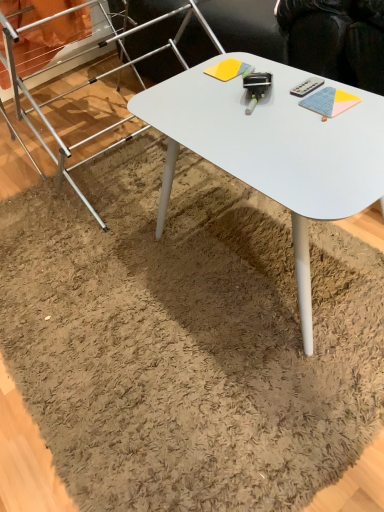
Identify the location of free space to the left of textured blue notepad at upper right, the 1th notepad when ordered from bottom to top. This screenshot has height=512, width=384. (259, 123).